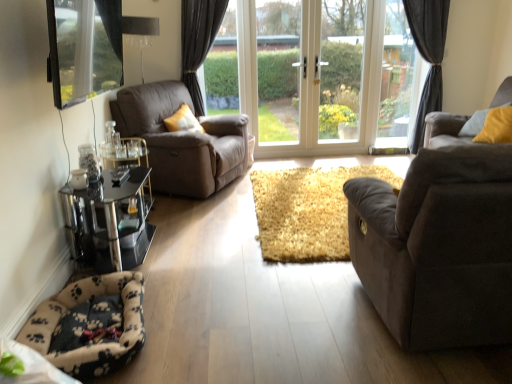
Question: Can you confirm if fluffy beige and black paw print cat bed at lower left, which is the first cat bed from bottom to top, is bigger than transparent glass window at upper left?

Choices:
 (A) yes
 (B) no

Answer: (B)

Question: Can you confirm if fluffy beige and black paw print cat bed at lower left, which ranks as the first cat bed in front-to-back order, is shorter than transparent glass window at upper left?

Choices:
 (A) no
 (B) yes

Answer: (B)

Question: Are fluffy beige and black paw print cat bed at lower left, the second cat bed viewed from the right, and transparent glass window at upper left located far from each other?

Choices:
 (A) no
 (B) yes

Answer: (B)

Question: From the image's perspective, would you say fluffy beige and black paw print cat bed at lower left, the first cat bed viewed from the left, is positioned over transparent glass window at upper left?

Choices:
 (A) no
 (B) yes

Answer: (A)

Question: From a real-world perspective, is fluffy beige and black paw print cat bed at lower left, which is the first cat bed from bottom to top, under transparent glass window at upper left?

Choices:
 (A) yes
 (B) no

Answer: (A)

Question: From a real-world perspective, is matte brown leather armchair at left physically located above or below clear glass window at upper center, the 1th window frame in the right-to-left sequence?

Choices:
 (A) above
 (B) below

Answer: (B)

Question: Considering the positions of matte brown leather armchair at left and clear glass window at upper center, positioned as the 2th window frame in left-to-right order, in the image, is matte brown leather armchair at left taller or shorter than clear glass window at upper center, positioned as the 2th window frame in left-to-right order,?

Choices:
 (A) tall
 (B) short

Answer: (B)

Question: Based on their sizes in the image, would you say matte brown leather armchair at left is bigger or smaller than clear glass window at upper center, the 1th window frame in the right-to-left sequence?

Choices:
 (A) big
 (B) small

Answer: (A)

Question: Is matte brown leather armchair at left inside the boundaries of clear glass window at upper center, the 1th window frame in the right-to-left sequence, or outside?

Choices:
 (A) inside
 (B) outside

Answer: (B)

Question: From their relative heights in the image, would you say fluffy beige carpet at center, which is counted as the first cat bed, starting from the back, is taller or shorter than dark gray fabric curtain at upper right?

Choices:
 (A) short
 (B) tall

Answer: (A)

Question: Is point (297, 203) closer or farther from the camera than point (418, 36)?

Choices:
 (A) closer
 (B) farther

Answer: (A)

Question: Based on their positions, is fluffy beige carpet at center, the 2th cat bed positioned from the bottom, located to the left or right of dark gray fabric curtain at upper right?

Choices:
 (A) right
 (B) left

Answer: (B)

Question: Is fluffy beige carpet at center, arranged as the 2th cat bed when viewed from the left, inside or outside of dark gray fabric curtain at upper right?

Choices:
 (A) outside
 (B) inside

Answer: (A)

Question: Do you think dark gray fabric curtain at upper right is within transparent glass window at upper left, or outside of it?

Choices:
 (A) inside
 (B) outside

Answer: (B)

Question: From the image's perspective, relative to transparent glass window at upper left, is dark gray fabric curtain at upper right above or below?

Choices:
 (A) above
 (B) below

Answer: (A)